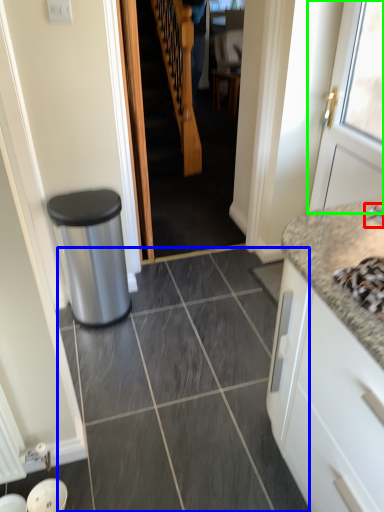
Question: Based on their relative distances, which object is nearer to faucet (highlighted by a red box)? Choose from granite (highlighted by a blue box) and door (highlighted by a green box).

Choices:
 (A) granite
 (B) door

Answer: (B)